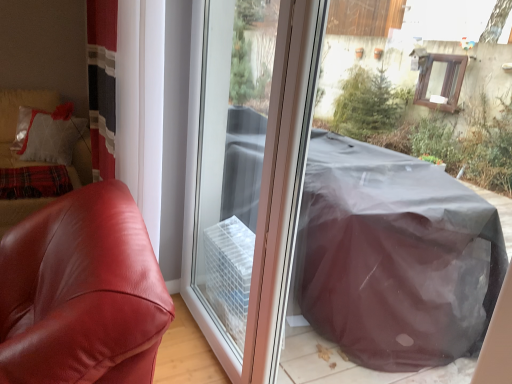
Question: Does matte leather couch at left come behind satin red armchair at left?

Choices:
 (A) no
 (B) yes

Answer: (B)

Question: Can you confirm if matte leather couch at left is shorter than satin red armchair at left?

Choices:
 (A) yes
 (B) no

Answer: (B)

Question: From the image's perspective, is matte leather couch at left under satin red armchair at left?

Choices:
 (A) no
 (B) yes

Answer: (A)

Question: Is matte leather couch at left aimed at satin red armchair at left?

Choices:
 (A) yes
 (B) no

Answer: (A)

Question: Can you confirm if matte leather couch at left is smaller than satin red armchair at left?

Choices:
 (A) yes
 (B) no

Answer: (B)

Question: Would you say transparent plastic screen door at center is to the left or to the right of satin red armchair at left in the picture?

Choices:
 (A) right
 (B) left

Answer: (A)

Question: Which is correct: transparent plastic screen door at center is inside satin red armchair at left, or outside of it?

Choices:
 (A) inside
 (B) outside

Answer: (B)

Question: In terms of width, does transparent plastic screen door at center look wider or thinner when compared to satin red armchair at left?

Choices:
 (A) wide
 (B) thin

Answer: (B)

Question: From a real-world perspective, relative to satin red armchair at left, is transparent plastic screen door at center vertically above or below?

Choices:
 (A) below
 (B) above

Answer: (B)

Question: Considering the positions of satin red armchair at left and matte leather couch at left in the image, is satin red armchair at left wider or thinner than matte leather couch at left?

Choices:
 (A) thin
 (B) wide

Answer: (A)

Question: Based on their positions, is satin red armchair at left located to the left or right of matte leather couch at left?

Choices:
 (A) left
 (B) right

Answer: (B)

Question: From the image's perspective, is satin red armchair at left above or below matte leather couch at left?

Choices:
 (A) above
 (B) below

Answer: (B)

Question: Is satin red armchair at left in front of or behind matte leather couch at left in the image?

Choices:
 (A) front
 (B) behind

Answer: (A)

Question: From the image's perspective, relative to transparent plastic screen door at center, is matte leather couch at left above or below?

Choices:
 (A) above
 (B) below

Answer: (A)

Question: Would you say matte leather couch at left is to the left or to the right of transparent plastic screen door at center in the picture?

Choices:
 (A) left
 (B) right

Answer: (A)